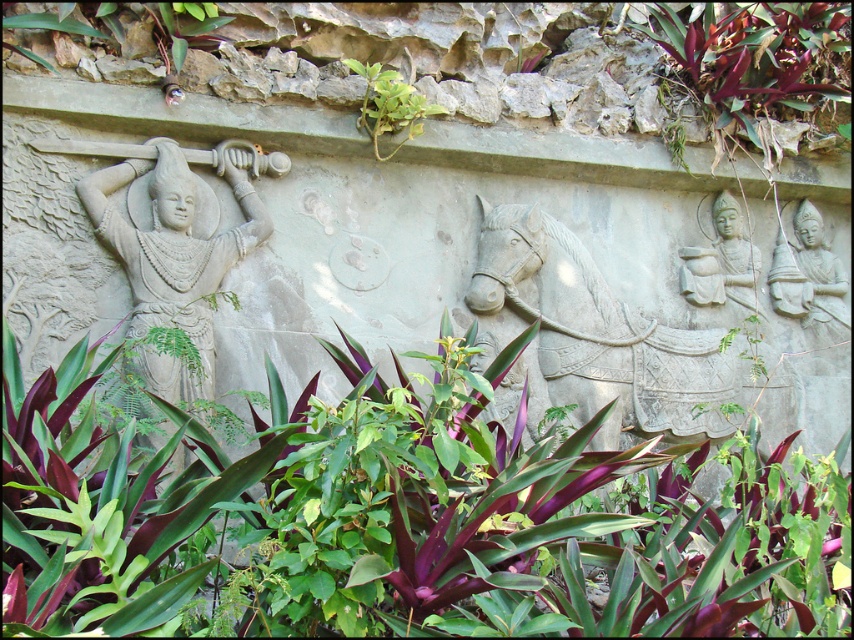
You are a gardener trying to water the purple leafy plant at center and the gray stone statue at center right. Which object requires more water? Please explain your reasoning based on their positions and the scene description.

The purple leafy plant at center requires more water because plants typically need regular watering, while the gray stone statue at center right, being made of stone, doesn not require water. The scene describes the statue as part of a stone relief with weathered texture, indicating it is nonliving and doesn need hydration.

You are an art conservator examining the stone relief sculpture. You notice the gray stone statue at left and the purple leafy plant at upper left. Which object occupies more horizontal space in the relief?

The gray stone statue at left occupies more horizontal space because its width is larger than the purple leafy plant at upper left.

You are an archaeologist examining the stone relief sculpture. You notice a purple leafy plant at center. Based on its coordinates, can you determine if it is closer to the left edge or the right edge of the relief?

The purple leafy plant at center is located at coordinates point (x=401, y=516), which means it is closer to the right edge of the relief.